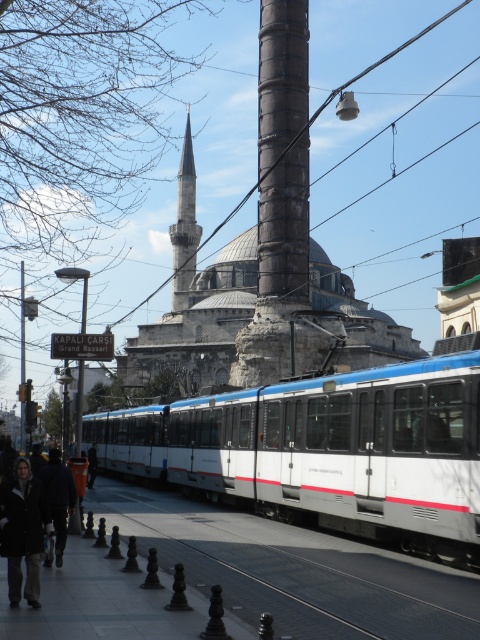
Question: Among these objects, which one is farthest from the camera?

Choices:
 (A) white glossy train at center
 (B) smooth stone minaret at center

Answer: (B)

Question: Does smooth stone minaret at center have a greater width compared to dark gray jacket at center?

Choices:
 (A) no
 (B) yes

Answer: (B)

Question: Among these objects, which one is nearest to the camera?

Choices:
 (A) dark gray jacket at center
 (B) white glossy train at center
 (C) smooth stone minaret at center
 (D) black fur coat at lower left

Answer: (D)

Question: Considering the relative positions of white glossy train at center and dark gray jacket at lower left in the image provided, where is white glossy train at center located with respect to dark gray jacket at lower left?

Choices:
 (A) left
 (B) right

Answer: (B)

Question: Does white glossy train at center have a larger size compared to black fur coat at lower left?

Choices:
 (A) yes
 (B) no

Answer: (A)

Question: Among these objects, which one is farthest from the camera?

Choices:
 (A) white glossy train at center
 (B) smooth stone minaret at center
 (C) black fur coat at lower left

Answer: (B)